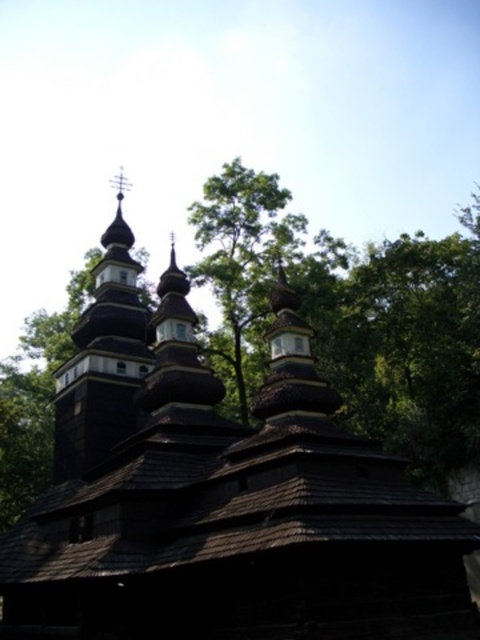
Question: Which object is farther from the camera taking this photo?

Choices:
 (A) dark brown wooden tower at upper left
 (B) dark wood church at center

Answer: (A)

Question: Can you confirm if dark wood church at center is positioned to the right of dark brown wooden tower at upper left?

Choices:
 (A) no
 (B) yes

Answer: (B)

Question: Is dark wood church at center positioned at the back of dark brown wooden tower at upper left?

Choices:
 (A) no
 (B) yes

Answer: (A)

Question: Is dark wood church at center closer to camera compared to dark brown wooden tower at upper left?

Choices:
 (A) no
 (B) yes

Answer: (B)

Question: Among these points, which one is nearest to the camera?

Choices:
 (A) (48, 556)
 (B) (117, 340)

Answer: (A)